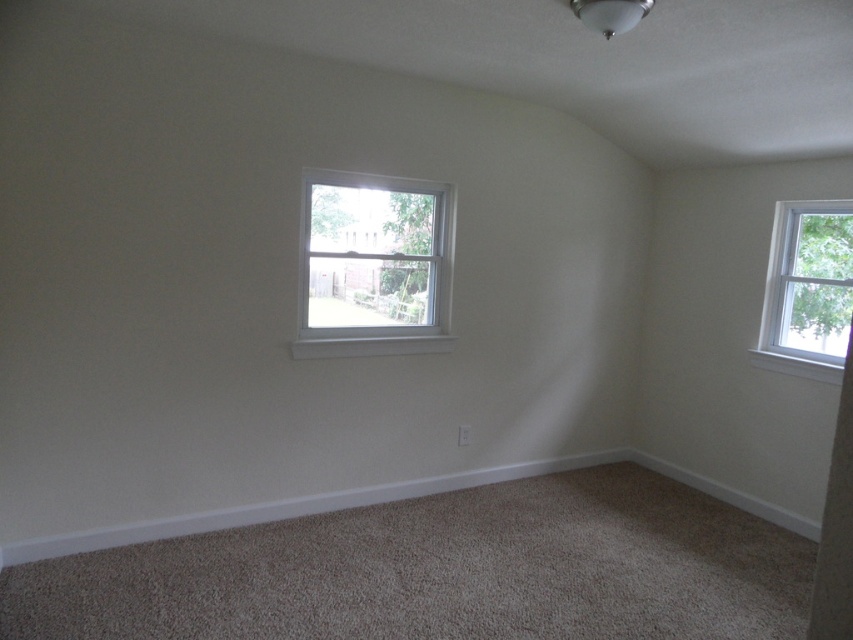
Question: Which point is closer to the camera taking this photo?

Choices:
 (A) (799, 237)
 (B) (373, 305)

Answer: (B)

Question: Can you confirm if white painted wood window at center is wider than white wood window at upper right?

Choices:
 (A) no
 (B) yes

Answer: (B)

Question: Among these objects, which one is nearest to the camera?

Choices:
 (A) white painted wood window at center
 (B) white wood window at upper right

Answer: (A)

Question: Can you confirm if white painted wood window at center is positioned below white wood window at upper right?

Choices:
 (A) yes
 (B) no

Answer: (B)

Question: Observing the image, what is the correct spatial positioning of white painted wood window at center in reference to white wood window at upper right?

Choices:
 (A) right
 (B) left

Answer: (B)

Question: Which point is farther to the camera?

Choices:
 (A) (370, 240)
 (B) (817, 282)

Answer: (A)